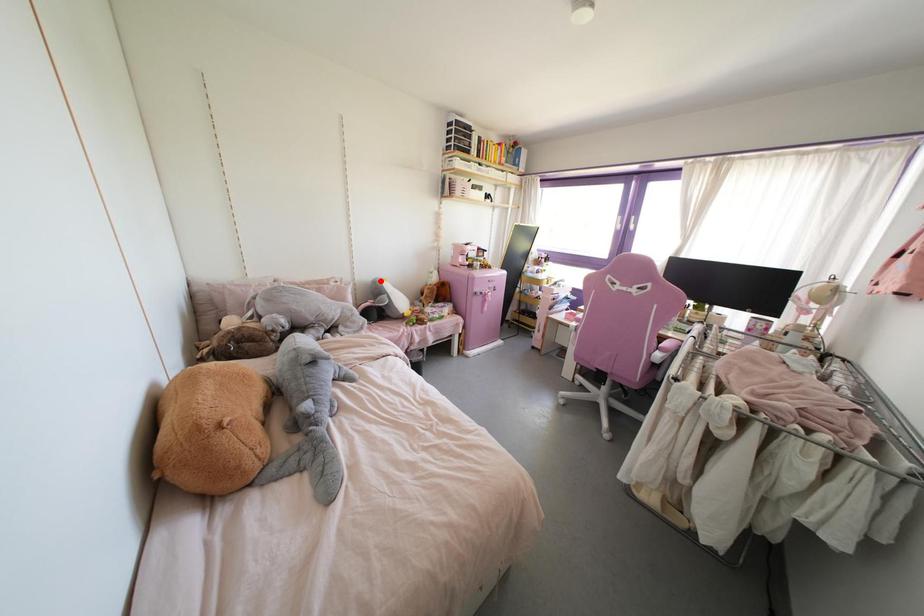
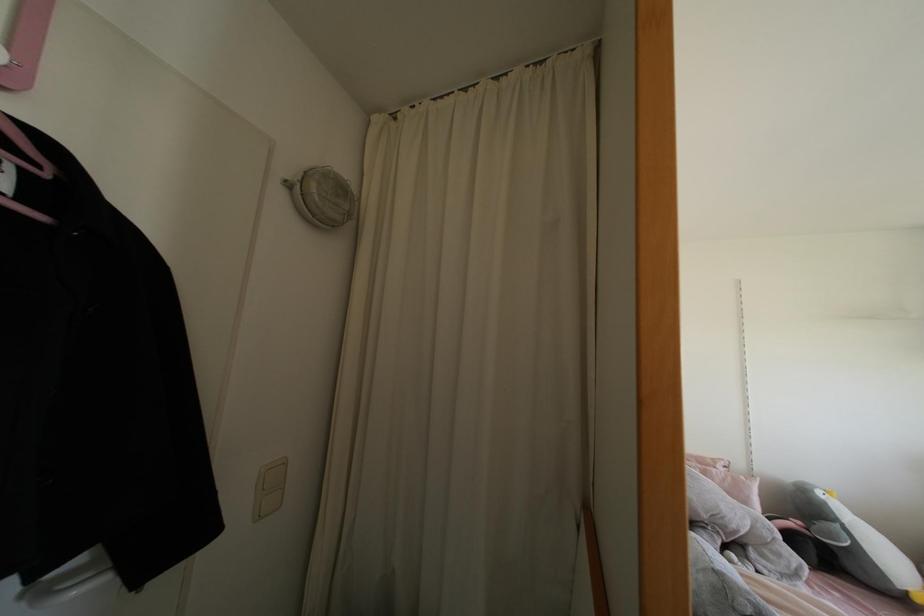
Locate, in the second image, the point that corresponds to the highlighted location in the first image.

(819, 493)